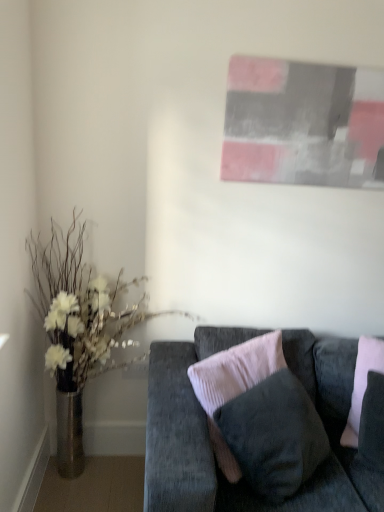
Where is `metallic vase at left`? Image resolution: width=384 pixels, height=512 pixels. metallic vase at left is located at coordinates (80, 330).

Locate an element on the screen. The height and width of the screenshot is (512, 384). velvet pink pillow at center is located at coordinates (362, 384).

This screenshot has width=384, height=512. I want to click on velvet dark gray couch at lower right, so click(x=208, y=433).

Find the location of a particular element. This screenshot has height=512, width=384. metallic vase at left is located at coordinates (80, 330).

Does velvet dark gray couch at lower right have a greater width compared to velvet pink pillow at center?

Indeed, velvet dark gray couch at lower right has a greater width compared to velvet pink pillow at center.

Is velvet dark gray couch at lower right oriented towards velvet pink pillow at center?

Yes, velvet dark gray couch at lower right is turned towards velvet pink pillow at center.

In the image, there is a velvet pink pillow at center. Identify the location of studio couch below it (from a real-world perspective). point(208,433).

From a real-world perspective, which is physically above, velvet dark gray couch at lower right or velvet pink pillow at center?

In real-world perspective, velvet pink pillow at center is above.

Can you confirm if velvet pink pillow at center is bigger than metallic vase at left?

Actually, velvet pink pillow at center might be smaller than metallic vase at left.

From the image's perspective, is velvet pink pillow at center over metallic vase at left?

No, from the image's perspective, velvet pink pillow at center is not over metallic vase at left.

What's the angular difference between velvet pink pillow at center and metallic vase at left's facing directions?

The angle between the facing direction of velvet pink pillow at center and the facing direction of metallic vase at left is 20.7 degrees.

Based on the photo, is velvet pink pillow at center not inside metallic vase at left?

Yes, velvet pink pillow at center is outside of metallic vase at left.

Which object is positioned more to the left, metallic vase at left or velvet pink pillow at center?

metallic vase at left is more to the left.

Is metallic vase at left turned away from velvet pink pillow at center?

That's not correct — metallic vase at left is not looking away from velvet pink pillow at center.

Between metallic vase at left and velvet pink pillow at center, which one has less height?

velvet pink pillow at center.

Considering the sizes of metallic vase at left and velvet pink pillow at center in the image, is metallic vase at left bigger or smaller than velvet pink pillow at center?

Considering their sizes, metallic vase at left takes up more space than velvet pink pillow at center.

Which is farther, (x=335, y=393) or (x=109, y=341)?

The point (x=109, y=341) is behind.

Is velvet dark gray couch at lower right turned away from metallic vase at left?

velvet dark gray couch at lower right does not have its back to metallic vase at left.

Which is behind, velvet dark gray couch at lower right or metallic vase at left?

metallic vase at left is behind.

Choose the correct answer: Is velvet pink pillow at center inside velvet dark gray couch at lower right or outside it?

velvet pink pillow at center is spatially positioned inside velvet dark gray couch at lower right.

Is the depth of velvet pink pillow at center less than that of velvet dark gray couch at lower right?

No, velvet pink pillow at center is further to the viewer.

Is point (355, 389) less distant than point (213, 484)?

That is False.

Considering the points (121, 329) and (150, 365), which point is behind, point (121, 329) or point (150, 365)?

The point (121, 329) is farther.

Is metallic vase at left aimed at velvet dark gray couch at lower right?

No, metallic vase at left is not facing towards velvet dark gray couch at lower right.

Is metallic vase at left with velvet dark gray couch at lower right?

No, metallic vase at left is not making contact with velvet dark gray couch at lower right.

Where is `studio couch lying on the left of velvet pink pillow at center`? studio couch lying on the left of velvet pink pillow at center is located at coordinates (208, 433).

I want to click on pillow that is below the metallic vase at left (from the image's perspective), so click(362, 384).

Looking at the image, which one is located closer to metallic vase at left, velvet dark gray couch at lower right or velvet pink pillow at center?

The object closer to metallic vase at left is velvet dark gray couch at lower right.

Based on their spatial positions, is velvet pink pillow at center or metallic vase at left closer to velvet dark gray couch at lower right?

The object closer to velvet dark gray couch at lower right is velvet pink pillow at center.

Considering their positions, is velvet pink pillow at center positioned closer to metallic vase at left than velvet dark gray couch at lower right?

Among the two, velvet dark gray couch at lower right is located nearer to metallic vase at left.

Considering their positions, is metallic vase at left positioned further to velvet dark gray couch at lower right than velvet pink pillow at center?

Among the two, metallic vase at left is located further to velvet dark gray couch at lower right.

When comparing their distances from velvet pink pillow at center, does metallic vase at left or velvet dark gray couch at lower right seem closer?

velvet dark gray couch at lower right.

Based on their spatial positions, is velvet dark gray couch at lower right or metallic vase at left closer to velvet pink pillow at center?

velvet dark gray couch at lower right is positioned closer to the anchor velvet pink pillow at center.

Identify the location of studio couch situated between metallic vase at left and velvet pink pillow at center from left to right. This screenshot has height=512, width=384. point(208,433).